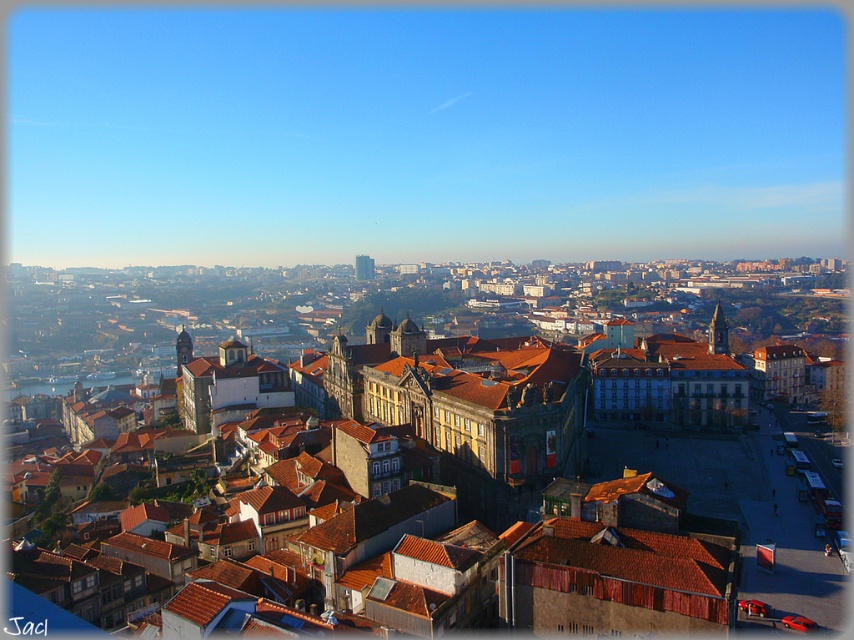
You are a city planner reviewing this urban layout. You need to determine which of the two towers, the brown stone tower at center or the smooth stone tower at center, is more suitable for installing a new observation deck. Based on their heights, which tower would you recommend?

The brown stone tower at center is much taller than the smooth stone tower at center, so it would be more suitable for installing a new observation deck as it offers a higher vantage point.

You are an architect analyzing the cityscape. You notice two towers labeled as brown stone tower at center and matte stone tower at center. Which one is positioned higher in the image?

The brown stone tower at center is positioned higher than the matte stone tower at center in the image.